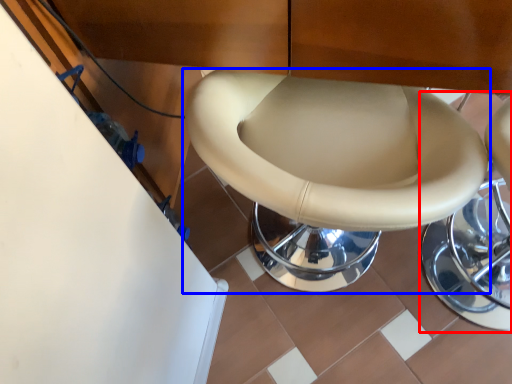
Question: Which object appears closest to the camera in this image, bar stool (highlighted by a red box) or toilet (highlighted by a blue box)?

Choices:
 (A) bar stool
 (B) toilet

Answer: (B)